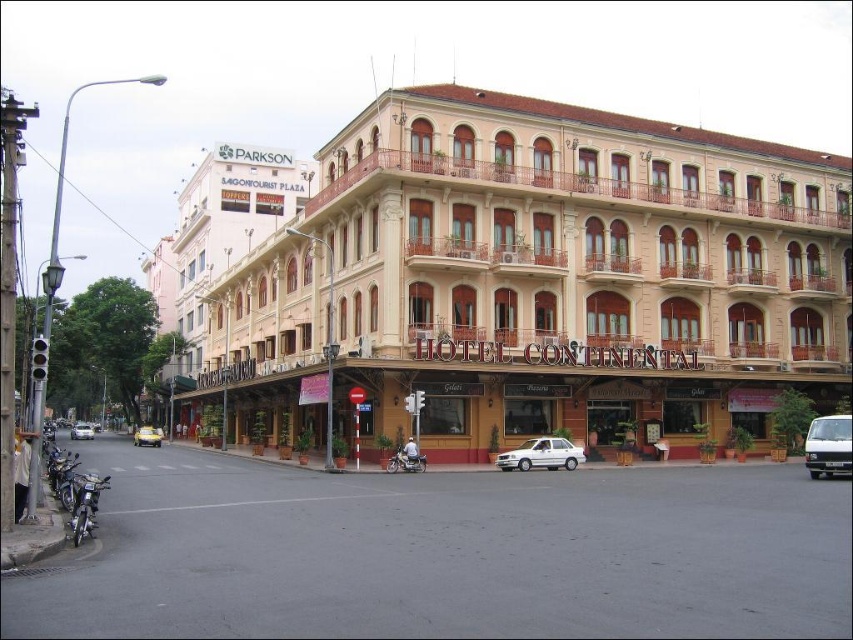
You are a pedestrian standing on the sidewalk in front of Hotel Continental. You see a metallic silver motorcycle at lower left and a yellow matte taxi at lower left. Which vehicle is nearer to you?

The metallic silver motorcycle at lower left is closer to the viewer than the yellow matte taxi at lower left, so the motorcycle is nearer to you.

You are standing at the viewpoint where the image was taken. There is a white matte sedan at center. Can you determine if the sedan is within a 50 meter safety zone required for a drone landing?

The white matte sedan at center is 65.34 meters away from the viewer, which exceeds the 50 meter safety zone. Therefore, the sedan is outside the required safety zone for drone landing.

You are a delivery driver who needs to park your white matte sedan at center in front of the Hotel Continental. The parking spot is located at coordinates point 0.711, 0.635. Is your car currently positioned correctly to park there?

The white matte sedan at center is already positioned at point (541,454), so it is correctly parked in front of the Hotel Continental.